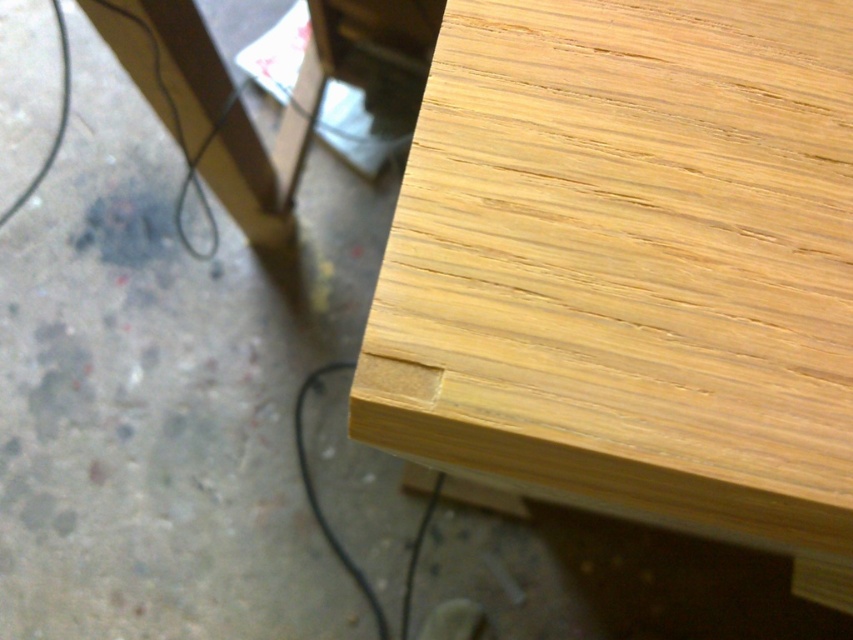
You are organizing cables on a desk and need to know which object is shorter between the natural wood table at upper right and the black rubber wire at lower center. Can you tell me which one is shorter?

The natural wood table at upper right is shorter than the black rubber wire at lower center.

Where is the natural wood table at upper right located in the image?

The natural wood table at upper right is located at point [631,268] in the image.

You are organizing cables in a workshop and see the natural wood table at upper right and the black rubber wire at lower center. Which object is positioned higher up in the image?

The natural wood table at upper right is located above the black rubber wire at lower center, so it is positioned higher up in the image.